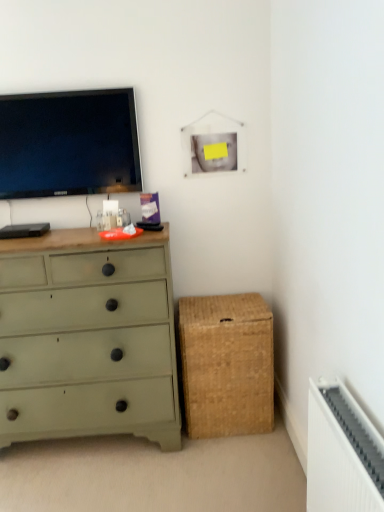
At what (x,y) coordinates should I click in order to perform the action: click on vacant space that's between green painted wood chest of drawers at left and braided wicker storage box at lower right. Please return your answer as a coordinate pair (x, y). This screenshot has height=512, width=384. Looking at the image, I should click on (224, 441).